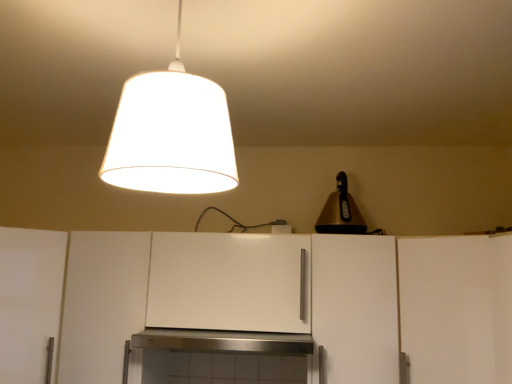
Question: Is gold metallic bell at upper right, acting as the 2th lamp starting from the left, spatially inside white matte cabinet at left, the first cabinetry viewed from the left, or outside of it?

Choices:
 (A) inside
 (B) outside

Answer: (B)

Question: From their relative heights in the image, would you say gold metallic bell at upper right, acting as the 2th lamp starting from the left, is taller or shorter than white matte cabinet at left, the fifth cabinetry viewed from the right?

Choices:
 (A) tall
 (B) short

Answer: (B)

Question: Which of these objects is positioned closest to the white matte cabinet at lower left, which appears as the 2th cabinetry when viewed from the left?

Choices:
 (A) white matte cabinet at left, the first cabinetry viewed from the left
 (B) white matte cabinet at right, which is counted as the 5th cabinetry, starting from the left
 (C) white matte cabinet at center, which appears as the 2th cabinetry when viewed from the right
 (D) white matte cabinet at center, arranged as the third cabinetry when viewed from the right
 (E) white fabric lampshade at upper center, which ranks as the 1th lamp in left-to-right order

Answer: (A)

Question: Which object is the closest to the white matte cabinet at center, which appears as the 2th cabinetry when viewed from the right?

Choices:
 (A) gold metallic bell at upper right, acting as the 2th lamp starting from the left
 (B) white matte cabinet at right, which is counted as the 5th cabinetry, starting from the left
 (C) white matte cabinet at center, arranged as the third cabinetry when viewed from the right
 (D) white matte cabinet at lower left, the 4th cabinetry when ordered from right to left
 (E) white fabric lampshade at upper center, which ranks as the 1th lamp in left-to-right order

Answer: (B)